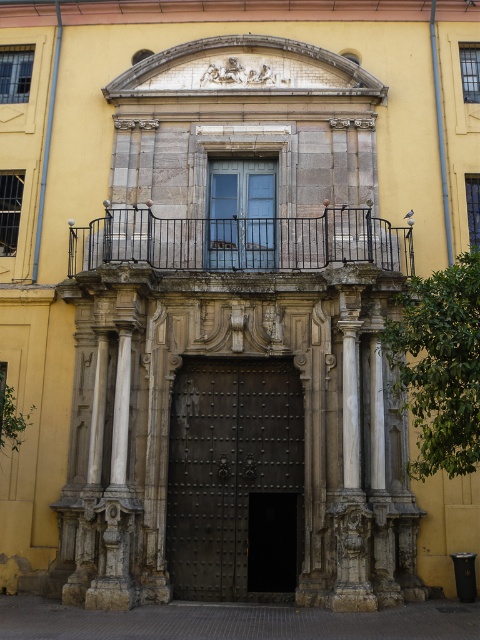
You are a maintenance worker who needs to reach both the dark brown metal gate at center and the black wrought iron balcony at upper center. You have a ladder that is 12 meters long. Can you safely reach both objects with this ladder without moving it?

The dark brown metal gate at center and the black wrought iron balcony at upper center are 12.45 meters apart. Since the ladder is only 12 meters long, it is not long enough to safely reach both objects without moving it.

You are standing at the camera position and want to take a photo of the black wrought iron balcony at upper center. Given that your camera has a maximum zoom range of 40 meters, will you be able to capture the entire balcony in your photo without moving closer?

The black wrought iron balcony at upper center and camera are 45.19 meters apart from each other. Since the camera can only zoom up to 40 meters, you will not be able to capture the entire balcony without moving closer.

You are a visitor approaching the entrance of the historic building. You notice the black wrought iron balcony at upper center and the matte glass door at center. Which object would block your view of the other when standing directly in front of the entrance?

The black wrought iron balcony at upper center is in front of the matte glass door at center, so it would block your view of the matte glass door at center when standing directly in front of the entrance.